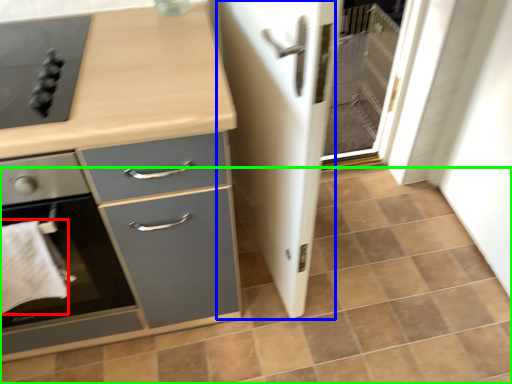
Question: Which object is the farthest from hand towel (highlighted by a red box)? Choose among these: screen door (highlighted by a blue box) or tile (highlighted by a green box).

Choices:
 (A) screen door
 (B) tile

Answer: (B)